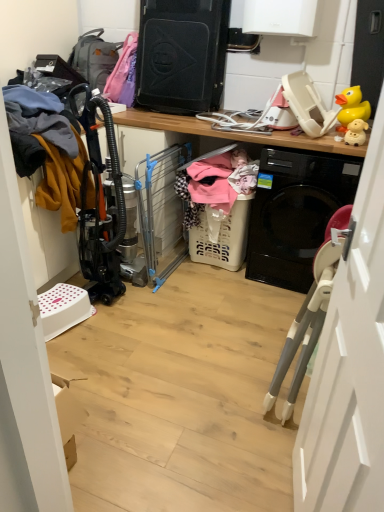
Find the location of a particular element. Image resolution: width=384 pixels, height=512 pixels. free space to the left of yellow rubber duck at upper right, arranged as the first toy when viewed from the back is located at coordinates (325, 129).